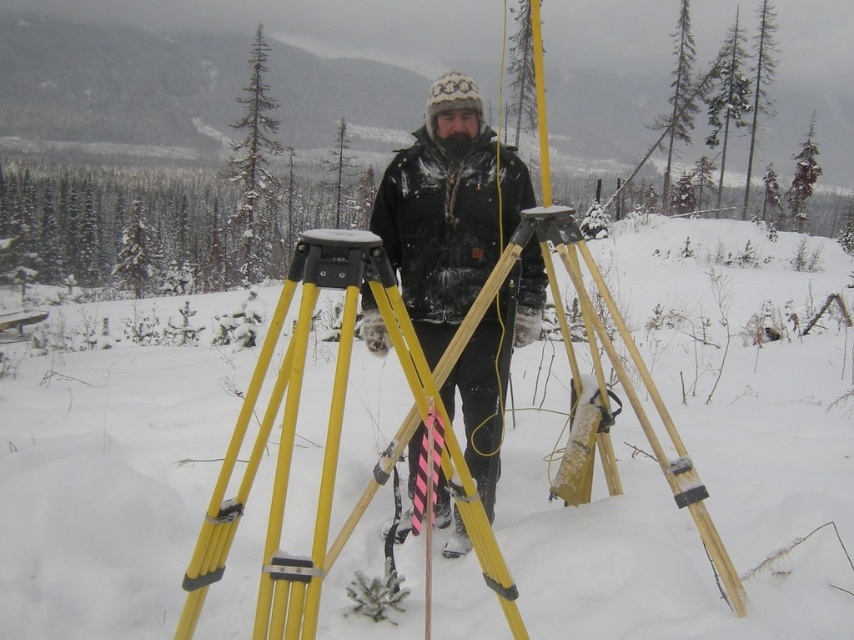
Question: In this image, where is white matte snow at center located relative to yellow plastic tripod at center?

Choices:
 (A) below
 (B) above

Answer: (B)

Question: Which of the following is the closest to the observer?

Choices:
 (A) yellow plastic tripod at center
 (B) black matte jacket at center
 (C) white matte snow at center

Answer: (A)

Question: Which point appears closest to the camera in this image?

Choices:
 (A) (487, 211)
 (B) (338, 392)
 (C) (340, 486)

Answer: (B)

Question: Which of the following is the farthest from the observer?

Choices:
 (A) yellow plastic tripod at center
 (B) white matte snow at center

Answer: (B)

Question: Is white matte snow at center above yellow plastic tripod at center?

Choices:
 (A) no
 (B) yes

Answer: (B)

Question: Is white matte snow at center in front of black matte jacket at center?

Choices:
 (A) no
 (B) yes

Answer: (A)